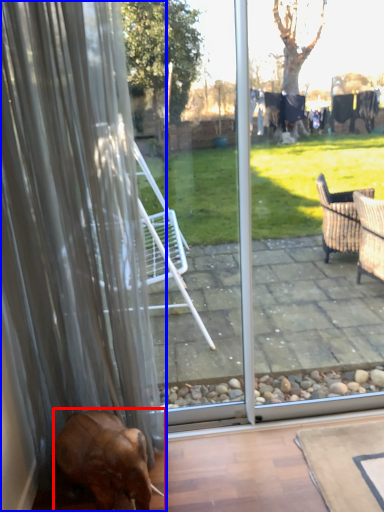
Question: Which point is closer to the camera, dog (highlighted by a red box) or curtain (highlighted by a blue box)?

Choices:
 (A) dog
 (B) curtain

Answer: (B)